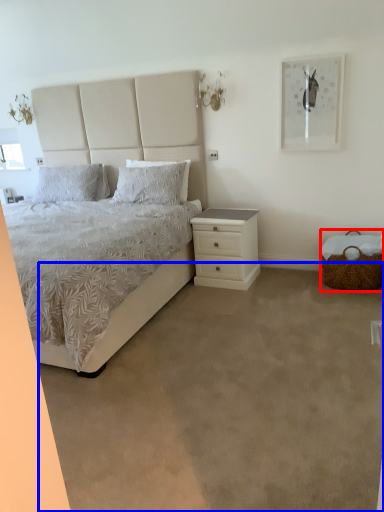
Question: Which object is closer to the camera taking this photo, basket (highlighted by a red box) or plain (highlighted by a blue box)?

Choices:
 (A) basket
 (B) plain

Answer: (B)